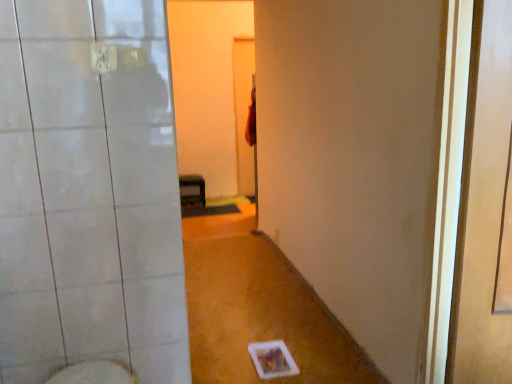
Question: Would you say matte black shelf at center is outside white glossy bidet at lower left?

Choices:
 (A) yes
 (B) no

Answer: (A)

Question: Considering the relative sizes of matte black shelf at center and white glossy bidet at lower left in the image provided, is matte black shelf at center wider than white glossy bidet at lower left?

Choices:
 (A) yes
 (B) no

Answer: (A)

Question: Is matte black shelf at center to the left of white glossy bidet at lower left from the viewer's perspective?

Choices:
 (A) yes
 (B) no

Answer: (A)

Question: Is white glossy bidet at lower left a part of matte black shelf at center?

Choices:
 (A) yes
 (B) no

Answer: (B)

Question: Is matte black shelf at center turned away from white glossy bidet at lower left?

Choices:
 (A) no
 (B) yes

Answer: (A)

Question: Considering the relative positions of matte black shelf at center and white glossy bidet at lower left in the image provided, is matte black shelf at center in front of white glossy bidet at lower left?

Choices:
 (A) yes
 (B) no

Answer: (B)

Question: From a real-world perspective, does transparent plastic screen door at right sit lower than white glossy bidet at lower left?

Choices:
 (A) yes
 (B) no

Answer: (B)

Question: Is white glossy bidet at lower left inside transparent plastic screen door at right?

Choices:
 (A) yes
 (B) no

Answer: (B)

Question: Can you confirm if transparent plastic screen door at right is positioned to the left of white glossy bidet at lower left?

Choices:
 (A) no
 (B) yes

Answer: (A)

Question: From a real-world perspective, does transparent plastic screen door at right stand above white glossy bidet at lower left?

Choices:
 (A) no
 (B) yes

Answer: (B)

Question: Is transparent plastic screen door at right facing away from white glossy bidet at lower left?

Choices:
 (A) yes
 (B) no

Answer: (A)

Question: Is transparent plastic screen door at right further to camera compared to white glossy bidet at lower left?

Choices:
 (A) yes
 (B) no

Answer: (B)

Question: From the image's perspective, is white glossy bidet at lower left below transparent plastic screen door at right?

Choices:
 (A) yes
 (B) no

Answer: (A)